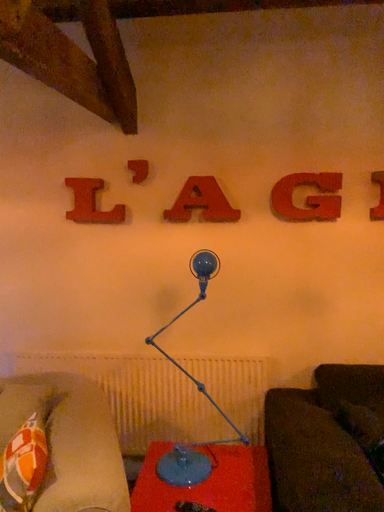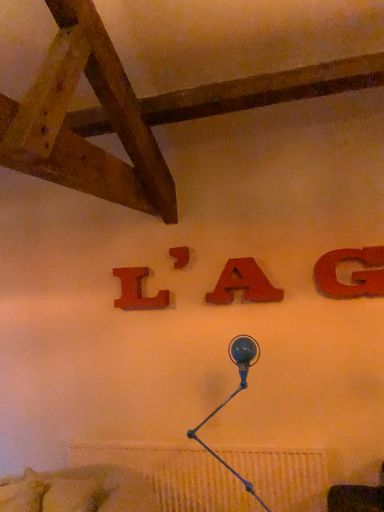
Question: How did the camera likely rotate when shooting the video?

Choices:
 (A) rotated left
 (B) rotated right

Answer: (A)